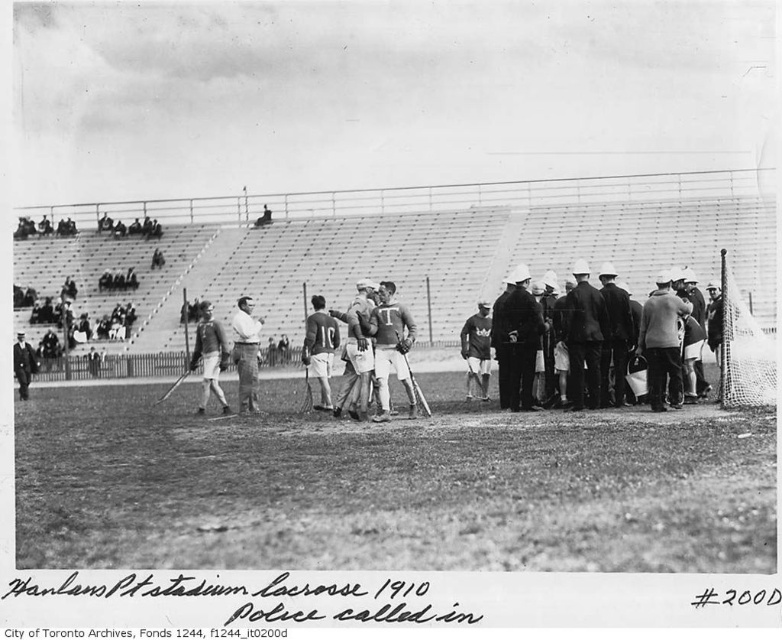
Does point (641, 332) lie in front of point (20, 381)?

Yes, point (641, 332) is closer to viewer.

Based on the photo, who is positioned more to the left, coarse wool sweater at center or smooth black suit at lower left?

smooth black suit at lower left

Is point (680, 300) in front of point (16, 369)?

Yes, point (680, 300) is closer to viewer.

Where is `coarse wool sweater at center`? coarse wool sweater at center is located at coordinates (662, 342).

What do you see at coordinates (669, 353) in the screenshot? I see `matte white uniform at center` at bounding box center [669, 353].

Can you confirm if matte white uniform at center is wider than smooth leather jacket at center?

Correct, the width of matte white uniform at center exceeds that of smooth leather jacket at center.

Locate an element on the screen. The width and height of the screenshot is (782, 640). matte white uniform at center is located at coordinates (669, 353).

Between matte leather jacket at center and smooth black suit at lower left, which one has more height?

With more height is matte leather jacket at center.

From the picture: Who is more distant from viewer, [375,326] or [20,396]?

The point [20,396] is more distant.

Which is in front, point (377, 356) or point (13, 371)?

Positioned in front is point (377, 356).

Locate an element on the screen. matte leather jacket at center is located at coordinates (391, 348).